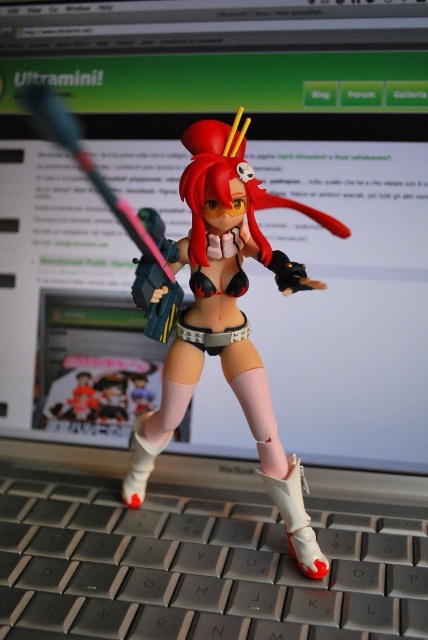
Does point (101, 621) come closer to viewer compared to point (187, 243)?

Yes, point (101, 621) is closer to viewer.

What do you see at coordinates (199, 568) in the screenshot? The height and width of the screenshot is (640, 428). I see `gray plastic keyboard at lower center` at bounding box center [199, 568].

Identify the location of gray plastic keyboard at lower center. The width and height of the screenshot is (428, 640). (199, 568).